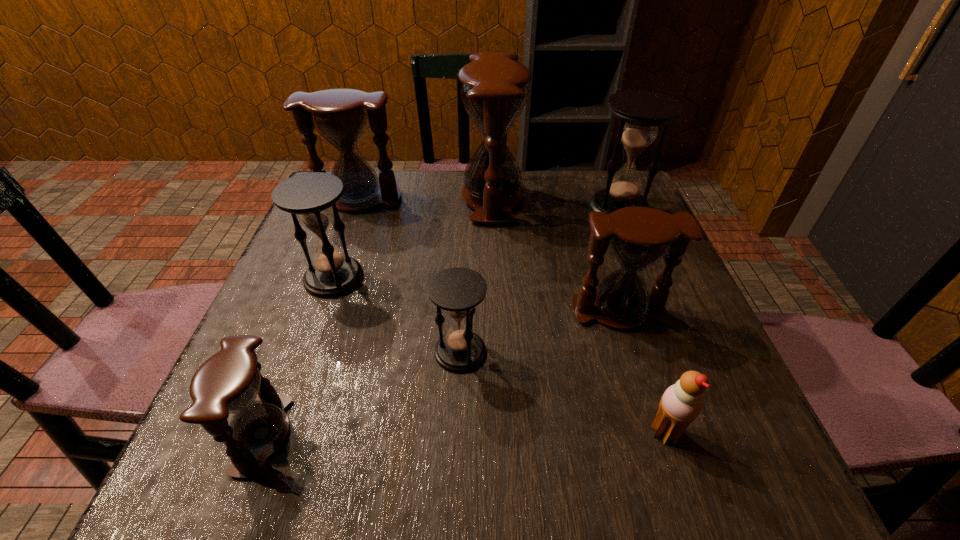
I want to click on black hourglass that is the second nearest to the smallest brown hourglass, so (310, 197).

This screenshot has height=540, width=960. Identify the location of free point that satisfies the following two spatial constraints: 1. on the front side of the third brown hourglass from left to right; 2. on the right side of the biggest black hourglass. (492, 208).

The height and width of the screenshot is (540, 960). I want to click on vacant area that satisfies the following two spatial constraints: 1. on the front side of the leftmost black hourglass; 2. on the left side of the smallest black hourglass, so click(x=307, y=352).